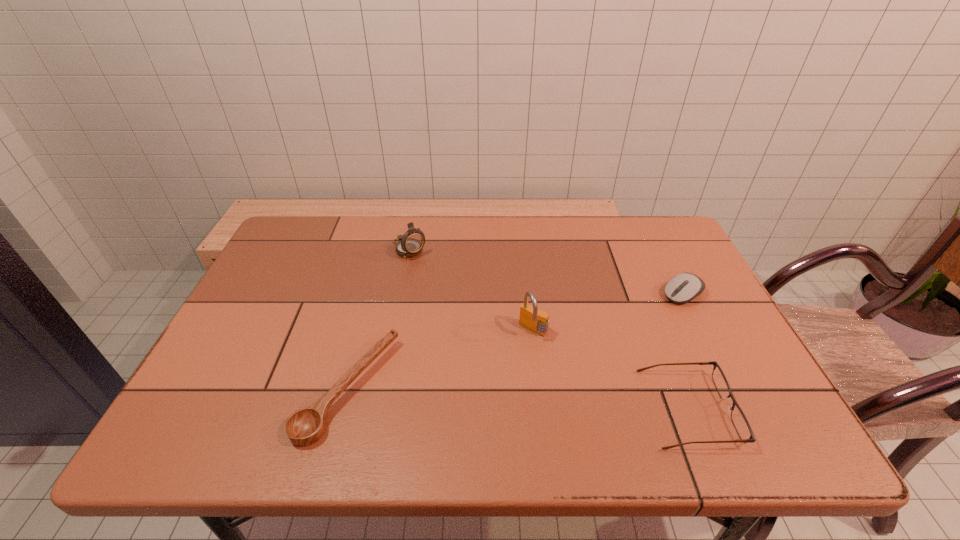
Locate an element on the screen. The width and height of the screenshot is (960, 540). vacant space that satisfies the following two spatial constraints: 1. on the front side of the compass; 2. on the left side of the third farthest object is located at coordinates (394, 330).

Identify the location of vacant space that satisfies the following two spatial constraints: 1. on the front side of the spectacles; 2. on the front-facing side of the wooden spoon. The height and width of the screenshot is (540, 960). (343, 409).

The image size is (960, 540). I want to click on blank area in the image that satisfies the following two spatial constraints: 1. on the front side of the spectacles; 2. on the front-facing side of the third object from right to left, so click(x=542, y=409).

Where is `vacant space that satisfies the following two spatial constraints: 1. on the back side of the computer equipment; 2. on the right side of the wooden spoon`? The width and height of the screenshot is (960, 540). vacant space that satisfies the following two spatial constraints: 1. on the back side of the computer equipment; 2. on the right side of the wooden spoon is located at coordinates (373, 294).

Find the location of a particular element. vacant point that satisfies the following two spatial constraints: 1. on the back side of the farthest object; 2. on the left side of the wooden spoon is located at coordinates (386, 249).

At what (x,y) coordinates should I click in order to perform the action: click on free location that satisfies the following two spatial constraints: 1. on the front side of the spectacles; 2. on the front-facing side of the wooden spoon. Please return your answer as a coordinate pair (x, y). Looking at the image, I should click on (343, 409).